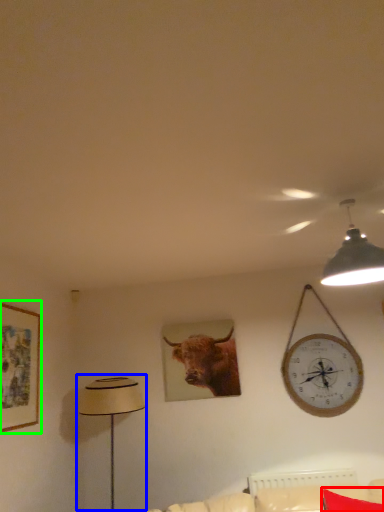
Question: Estimate the real-world distances between objects in this image. Which object is farther from pillow (highlighted by a red box), table lamp (highlighted by a blue box) or picture frame (highlighted by a green box)?

Choices:
 (A) table lamp
 (B) picture frame

Answer: (B)